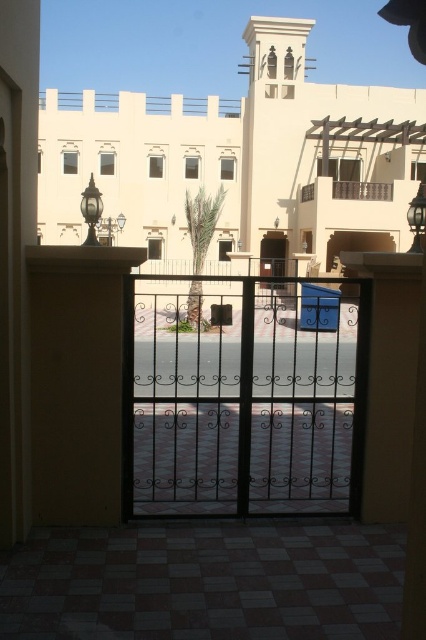
You are a delivery person trying to enter the courtyard through the black wrought iron gate at center. The wooden slats balcony at upper center is where the security camera is located. To avoid being recorded, you need to stay at least 10 meters away from the camera. Can you safely pass through the gate without being recorded?

The distance between the black wrought iron gate at center and the wooden slats balcony at upper center is 10.11 meters. Since the required distance to avoid being recorded is at least 10 meters, passing through the gate would keep you just beyond the 10 meter threshold, so you can safely pass through the gate without being recorded.

In the scene shown: You are standing outside the courtyard and want to enter through the entrance. The black wrought iron gate at center and the clear glass screen door at center are both in your path. Which one should you open first to enter?

The black wrought iron gate at center is positioned on the left side of clear glass screen door at center, so you should open the black wrought iron gate at center first before opening the clear glass screen door at center to enter.